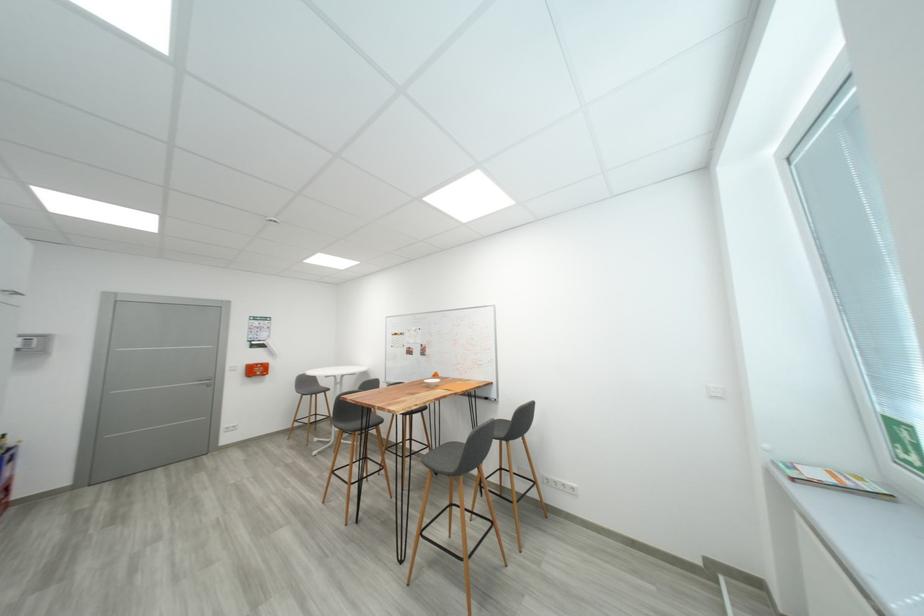
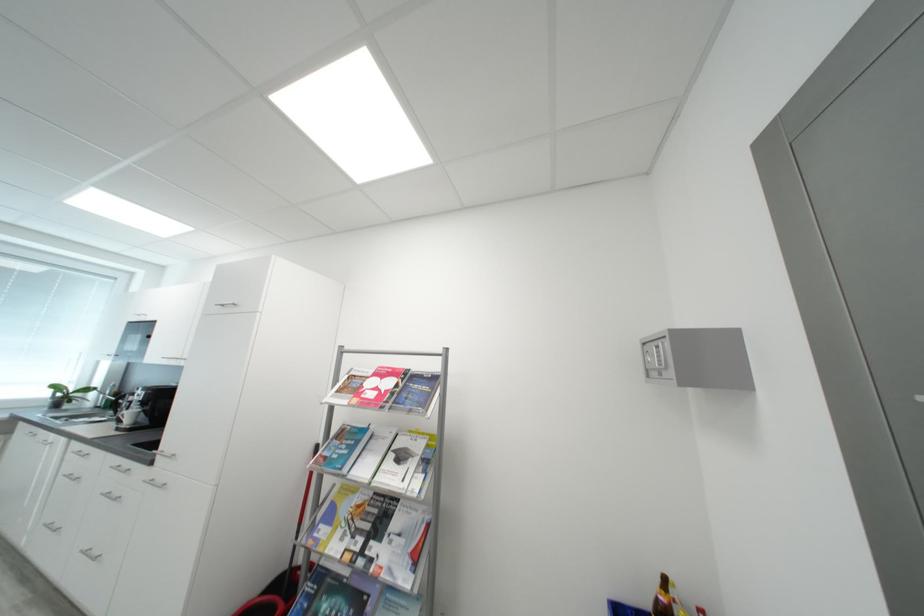
In the second image, find the point that corresponds to the point at 34,346 in the first image.

(666, 362)